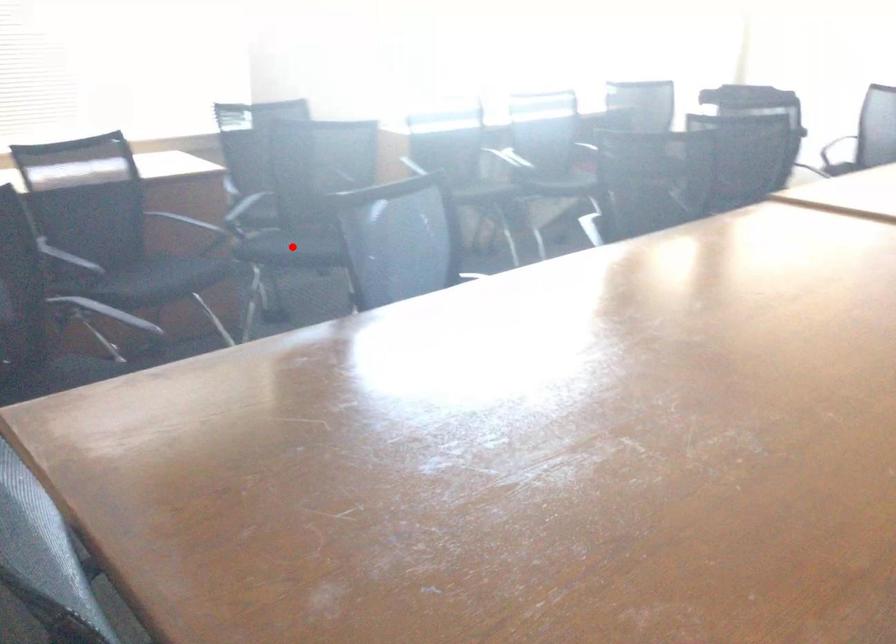
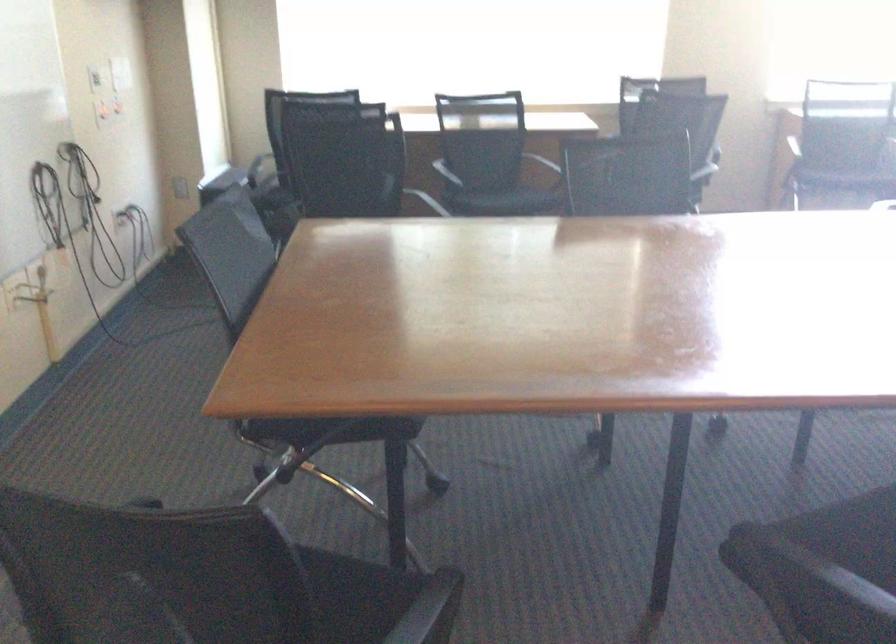
Question: I am providing you with two images of the same scene from different viewpoints. A red point is marked on the first image. Is the red point's position out of view in image 2?

Choices:
 (A) Yes
 (B) No

Answer: (A)